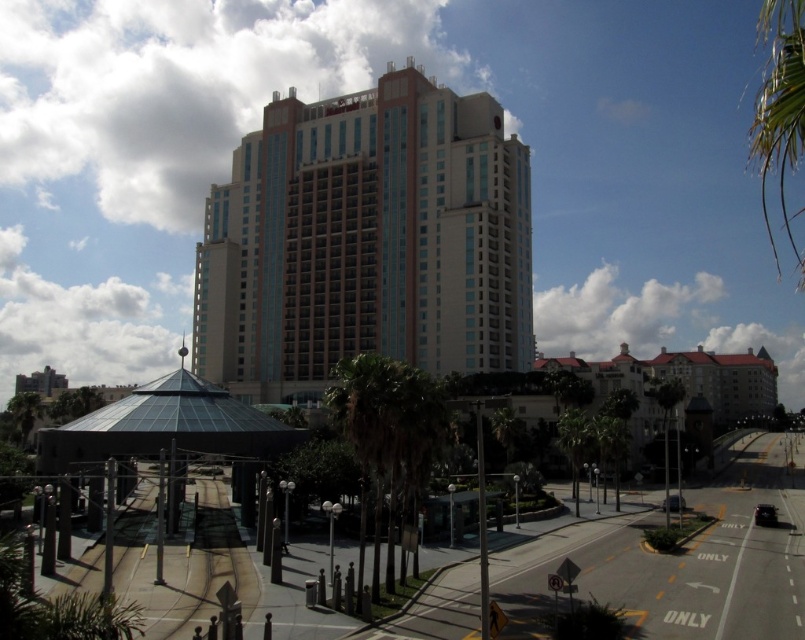
You are a city planner evaluating the urban layout. Considering the beige glass building at center and the green leafy palm tree at upper right, which structure appears smaller in the image?

The beige glass building at center appears smaller in the image compared to the green leafy palm tree at upper right as stated in the description.

You are a city planner evaluating the urban space. Given the beige glass building at center and the green leafy palm tree at center, which one has a greater width from an observer standing in front of them?

The beige glass building at center might be wider than green leafy palm tree at center, so the beige glass building at center likely has a greater width from an observer standing in front of them.